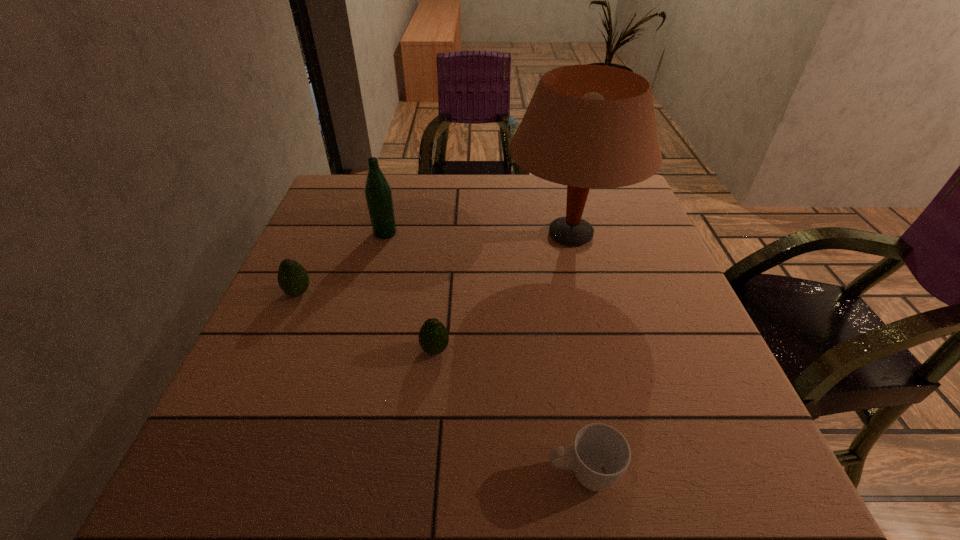
Locate an element on the screen. The image size is (960, 540). the tallest object is located at coordinates (587, 126).

The image size is (960, 540). In order to click on bottle in this screenshot , I will do `click(378, 194)`.

This screenshot has width=960, height=540. In order to click on the second tallest object in this screenshot , I will do `click(378, 194)`.

The width and height of the screenshot is (960, 540). I want to click on the third farthest object, so click(x=293, y=279).

This screenshot has height=540, width=960. I want to click on the leftmost object, so click(293, 279).

The height and width of the screenshot is (540, 960). Find the location of `the nearer avocado`. the nearer avocado is located at coordinates (433, 336).

What are the coordinates of `the right avocado` in the screenshot? It's located at (433, 336).

You are a GUI agent. You are given a task and a screenshot of the screen. Output one action in this format:
    pyautogui.click(x=<x>, y=<y>)
    Task: Click on the nearest object
    
    Given the screenshot: What is the action you would take?
    pyautogui.click(x=600, y=454)

Find the location of `vacant space situated on the front-facing side of the tallest object`. vacant space situated on the front-facing side of the tallest object is located at coordinates (359, 234).

The width and height of the screenshot is (960, 540). I want to click on free region located 0.080m on the front-facing side of the tallest object, so click(x=473, y=234).